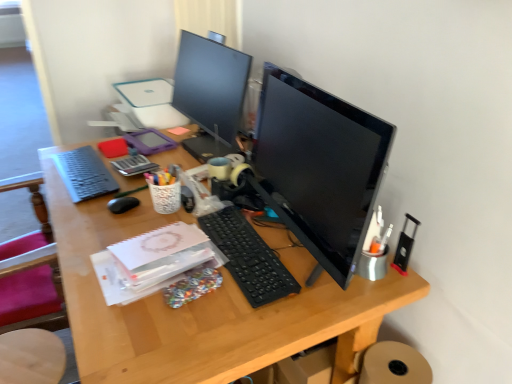
Question: Can you confirm if black plastic keyboard at center, which is counted as the 1th computer keyboard, starting from the right, is positioned to the left of wooden seat at lower left?

Choices:
 (A) yes
 (B) no

Answer: (B)

Question: From a real-world perspective, is black plastic keyboard at center, which is counted as the 2th computer keyboard, starting from the left, beneath wooden seat at lower left?

Choices:
 (A) yes
 (B) no

Answer: (B)

Question: Does black plastic keyboard at center, placed as the second computer keyboard when sorted from back to front, turn towards wooden seat at lower left?

Choices:
 (A) yes
 (B) no

Answer: (B)

Question: Is black plastic keyboard at center, which is counted as the 2th computer keyboard, starting from the left, behind wooden seat at lower left?

Choices:
 (A) yes
 (B) no

Answer: (B)

Question: Does black plastic keyboard at center, which is counted as the 1th computer keyboard, starting from the right, have a lesser height compared to wooden seat at lower left?

Choices:
 (A) yes
 (B) no

Answer: (A)

Question: From a real-world perspective, is black glossy monitor at center, which is the second computer monitor from left to right, beneath metallic black stapler at right, the first stationery from the bottom?

Choices:
 (A) yes
 (B) no

Answer: (B)

Question: Is metallic black stapler at right, acting as the second stationery starting from the back, inside black glossy monitor at center, which is the second computer monitor from left to right?

Choices:
 (A) no
 (B) yes

Answer: (A)

Question: Is black glossy monitor at center, which is the second computer monitor from left to right, aimed at metallic black stapler at right, acting as the second stationery starting from the back?

Choices:
 (A) yes
 (B) no

Answer: (B)

Question: Is black glossy monitor at center, which is counted as the 1th computer monitor, starting from the front, oriented away from metallic black stapler at right, which appears as the first stationery when viewed from the front?

Choices:
 (A) no
 (B) yes

Answer: (B)

Question: Does black glossy monitor at center, the first computer monitor from the right, appear on the left side of metallic black stapler at right, which is the 1th stationery in right-to-left order?

Choices:
 (A) no
 (B) yes

Answer: (B)

Question: Does black glossy monitor at center, the second computer monitor when ordered from back to front, have a larger size compared to metallic black stapler at right, the 2th stationery from the left?

Choices:
 (A) yes
 (B) no

Answer: (A)

Question: Is wooden seat at lower left shorter than black plastic keyboard at center, which is counted as the 1th computer keyboard, starting from the right?

Choices:
 (A) no
 (B) yes

Answer: (A)